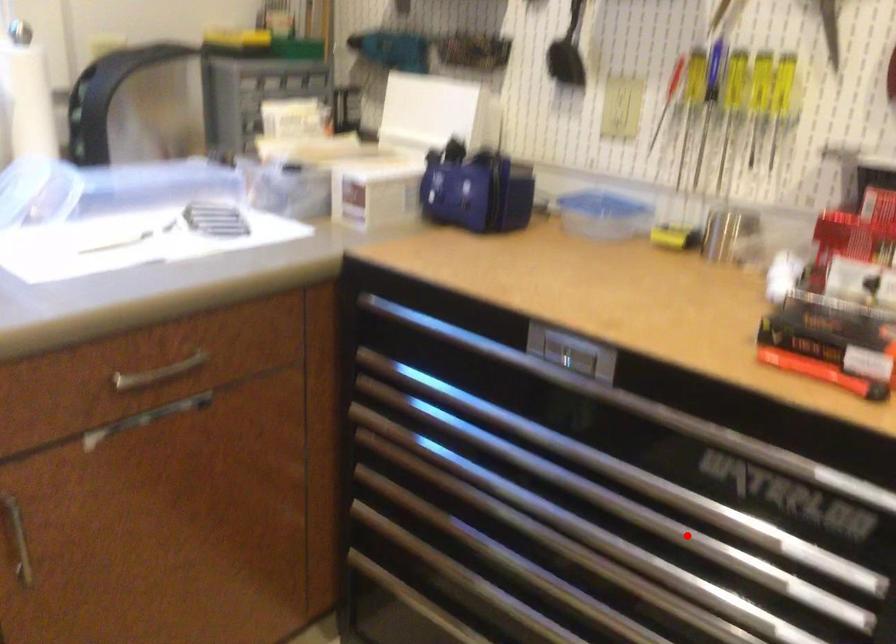
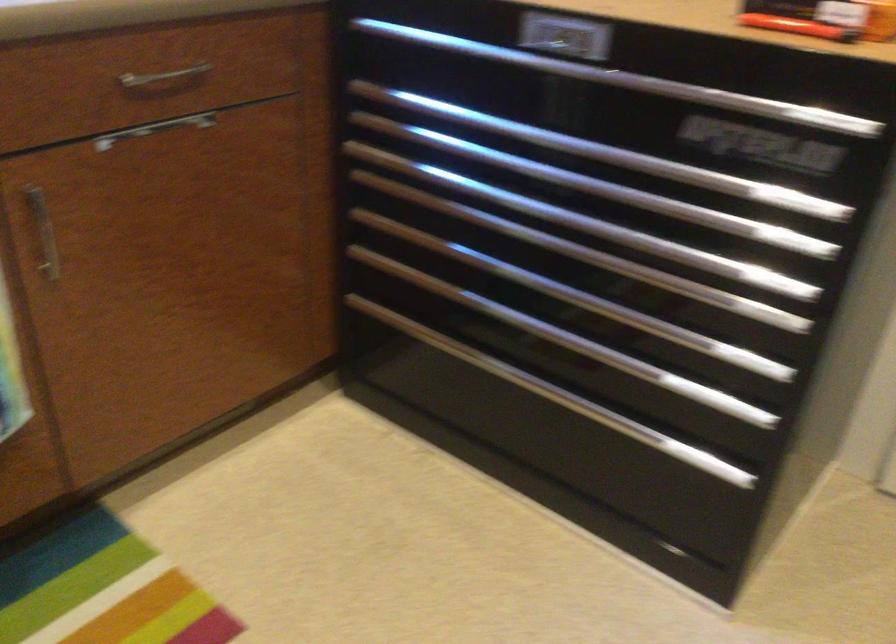
Question: I am providing you with two images of the same scene from different viewpoints. A red point is marked on the first image. At the location where the point appears in image 1, is it still visible in image 2?

Choices:
 (A) Yes
 (B) No

Answer: (A)